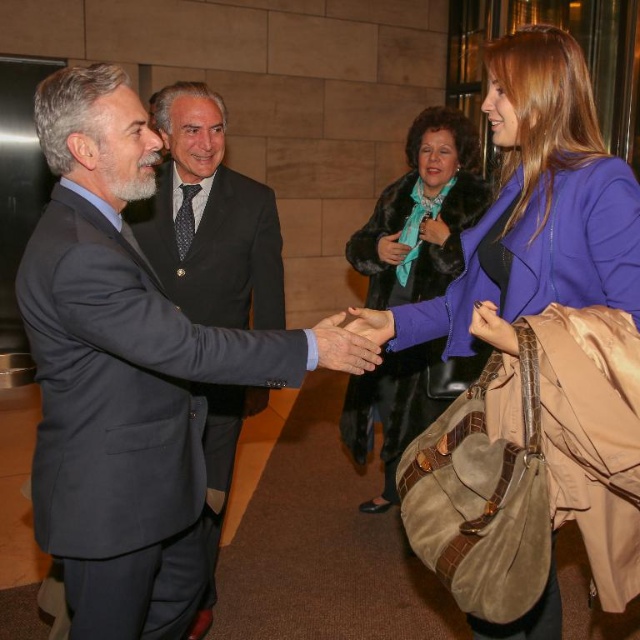
Is dark gray wool suit at center closer to the viewer compared to velvet teal scarf at center?

Yes, dark gray wool suit at center is in front of velvet teal scarf at center.

Where is `dark gray wool suit at center`? dark gray wool suit at center is located at coordinates (124, 387).

The image size is (640, 640). In order to click on dark gray wool suit at center in this screenshot , I will do `click(124, 387)`.

Is dark blue suit at center positioned behind velvet teal scarf at center?

That is False.

Image resolution: width=640 pixels, height=640 pixels. I want to click on dark blue suit at center, so click(x=209, y=220).

Looking at this image, does dark gray wool suit at center have a smaller size compared to purple suede coat at center?

No.

Between point (88, 538) and point (561, 262), which one is positioned in front?

Point (88, 538) is in front.

Between point (209, 349) and point (486, 92), which one is positioned in front?

Point (209, 349) is more forward.

Image resolution: width=640 pixels, height=640 pixels. I want to click on dark gray wool suit at center, so click(124, 387).